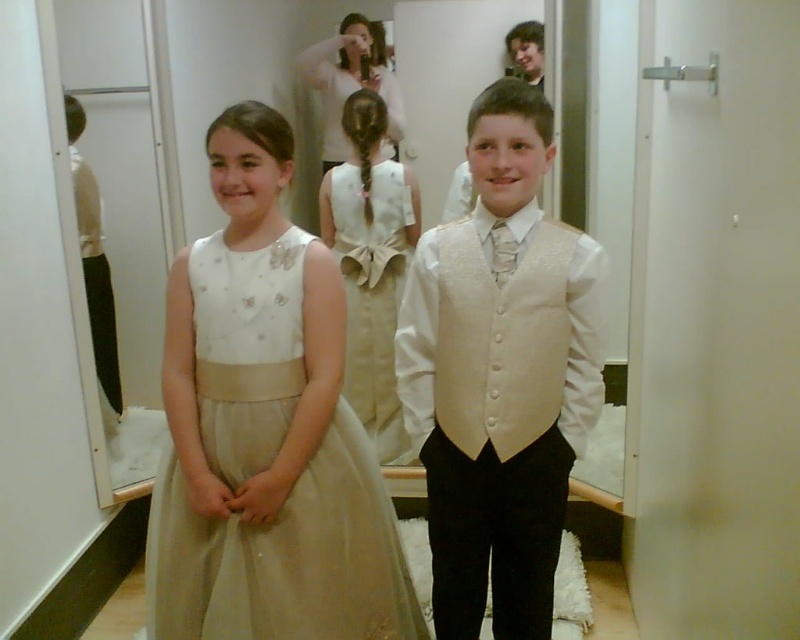
Is matte white tulle dress at center behind ivory satin dress at center?

No, it is in front of ivory satin dress at center.

Which is behind, point (318, 488) or point (364, 428)?

The point (364, 428) is more distant.

Is point (296, 531) behind point (360, 198)?

No, it is not.

In order to click on matte white tulle dress at center in this screenshot , I will do `click(284, 556)`.

Between point (582, 280) and point (366, 465), which one is positioned in front?

Point (582, 280) is in front.

Is point (520, 189) farther from viewer compared to point (176, 630)?

No, it is in front of (176, 630).

Where is `satin white vest at center`? This screenshot has height=640, width=800. satin white vest at center is located at coordinates (500, 374).

Is satin white vest at center below ivory satin dress at center?

Indeed, satin white vest at center is positioned under ivory satin dress at center.

Does point (470, 300) come in front of point (405, 452)?

Yes, it is.

I want to click on satin white vest at center, so click(500, 374).